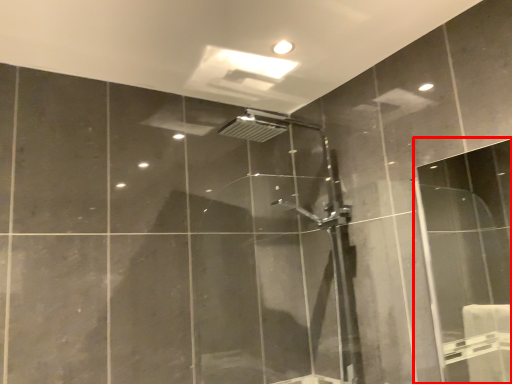
Question: From the image's perspective, what is the correct spatial positioning of screen door (annotated by the red box) in reference to shower door?

Choices:
 (A) below
 (B) above

Answer: (B)